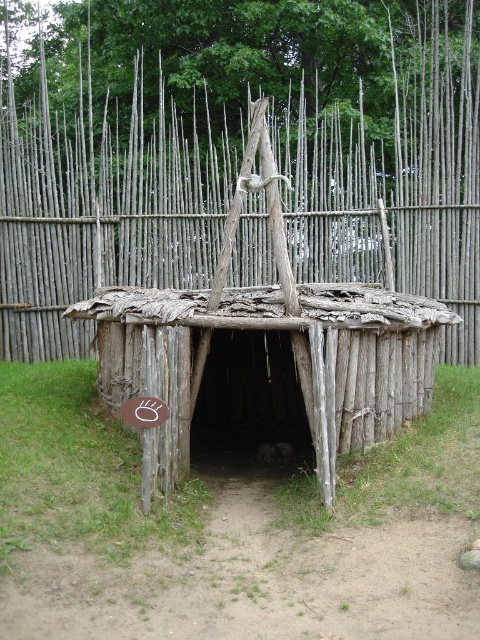
Is gray wooden fence at center smaller than weathered wood hut at center?

No, gray wooden fence at center is not smaller than weathered wood hut at center.

Between gray wooden fence at center and weathered wood hut at center, which one is positioned lower?

weathered wood hut at center is below.

Which is in front, point (342, 131) or point (160, 301)?

Point (160, 301) is more forward.

You are a GUI agent. You are given a task and a screenshot of the screen. Output one action in this format:
    pyautogui.click(x=<x>, y=<y>)
    Task: Click on the gray wooden fence at center
    The image size is (480, 640).
    Given the screenshot: What is the action you would take?
    pyautogui.click(x=103, y=205)

Does green grass at center have a lesser height compared to weathered wood hut at center?

Yes.

Describe the element at coordinates (231, 531) in the screenshot. The image size is (480, 640). I see `green grass at center` at that location.

Is point (49, 600) more distant than point (414, 369)?

No, it is in front of (414, 369).

This screenshot has height=640, width=480. I want to click on green grass at center, so click(231, 531).

Can you confirm if green grass at center is positioned to the left of gray wooden fence at center?

Correct, you'll find green grass at center to the left of gray wooden fence at center.

Does point (95, 467) come farther from viewer compared to point (144, 188)?

No.

Describe the element at coordinates (231, 531) in the screenshot. I see `green grass at center` at that location.

Locate an element on the screen. The image size is (480, 640). green grass at center is located at coordinates (231, 531).